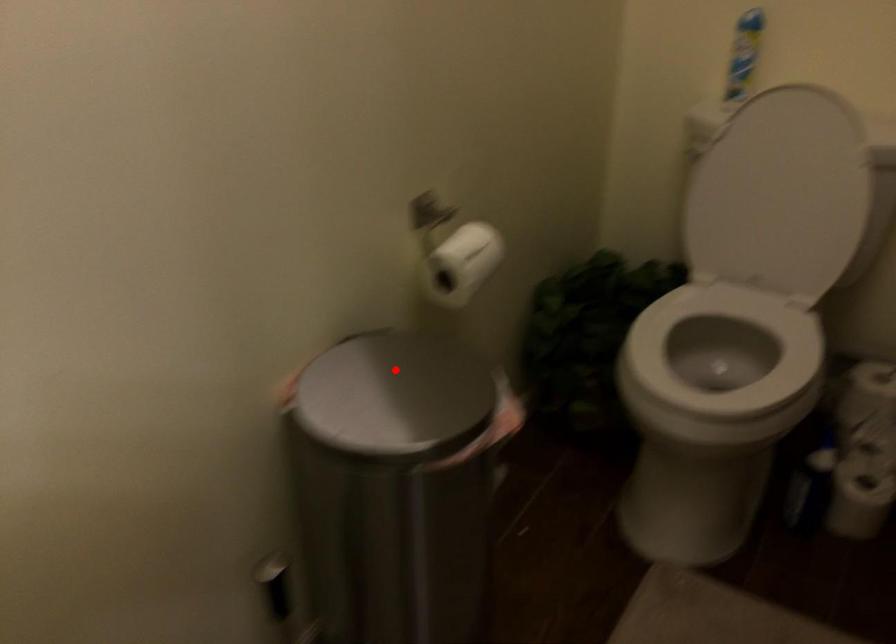
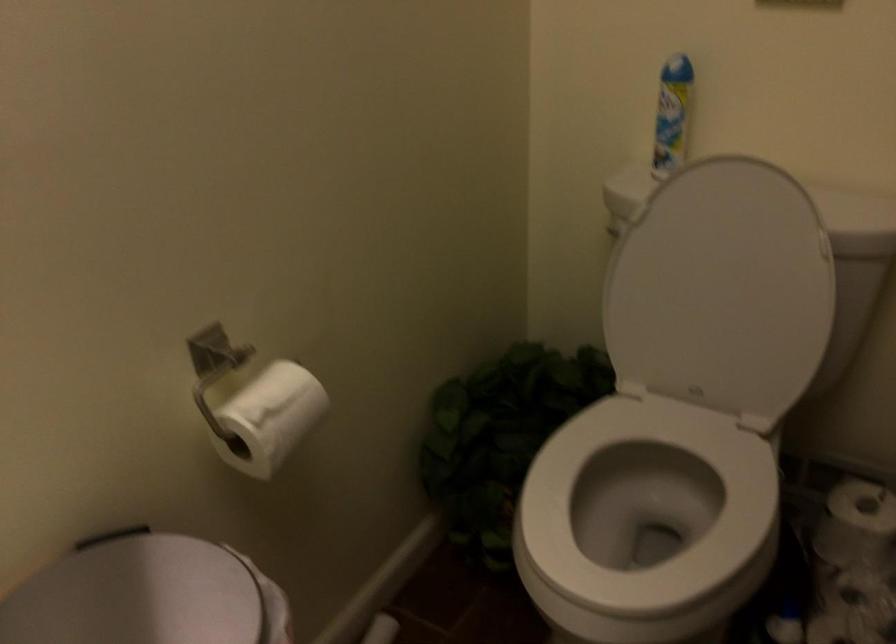
Question: I am providing you with two images of the same scene from different viewpoints. A red point is shown in image1. For the corresponding object point in image2, is it positioned nearer or farther from the camera?

Choices:
 (A) Nearer
 (B) Farther

Answer: (A)